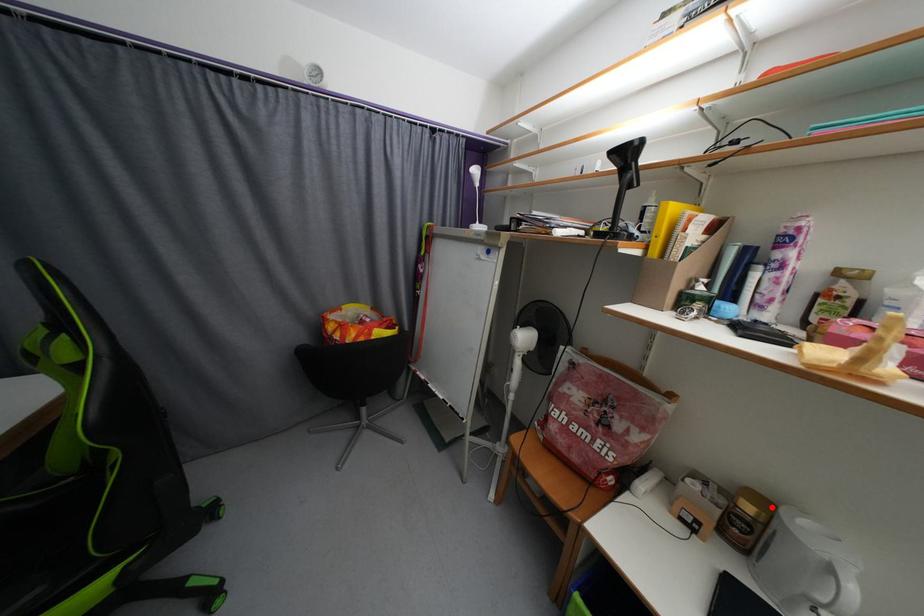
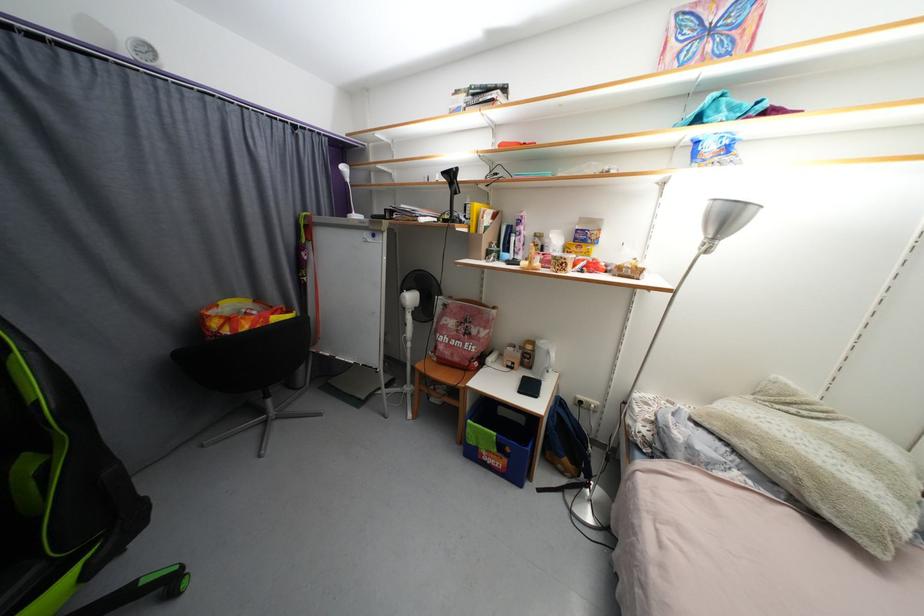
Where in the second image is the point corresponding to the highlighted location from the first image?

(538, 344)